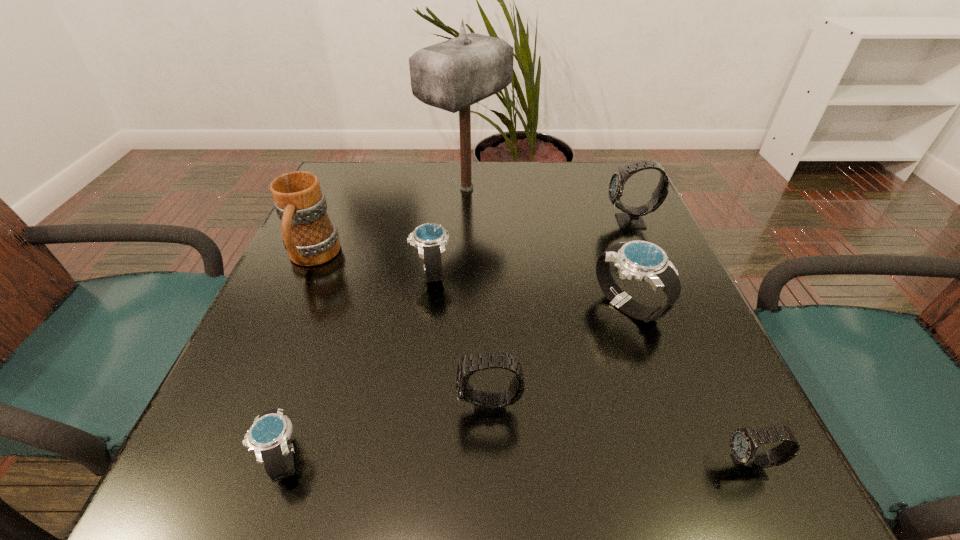
I want to click on vacant space located on the face of the leftmost gray watch, so pos(331,409).

Find the location of a particular element. This screenshot has height=540, width=960. vacant space located on the back of the second watch from left to right is located at coordinates (x=441, y=198).

Locate an element on the screen. free spot located 0.320m on the face of the smallest gray watch is located at coordinates (487, 468).

Where is `free space located on the face of the smallest gray watch`? The image size is (960, 540). free space located on the face of the smallest gray watch is located at coordinates (471, 468).

Find the location of a particular element. Image resolution: width=960 pixels, height=540 pixels. vacant space located 0.130m on the face of the smallest gray watch is located at coordinates (627, 468).

The image size is (960, 540). I want to click on free point located on the back of the shortest object, so click(351, 258).

This screenshot has height=540, width=960. I want to click on object that is at the far edge, so click(452, 75).

Where is `mug situated at the left edge`? mug situated at the left edge is located at coordinates (311, 239).

This screenshot has width=960, height=540. What are the coordinates of `watch located in the left edge section of the desktop` in the screenshot? It's located at (x=269, y=437).

The height and width of the screenshot is (540, 960). In order to click on object present at the near left corner in this screenshot , I will do `click(269, 437)`.